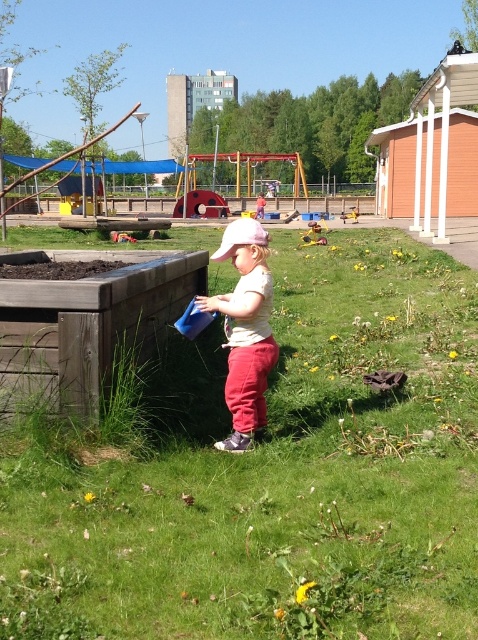
Does green grass at center have a smaller size compared to matte white shirt at center?

Incorrect, green grass at center is not smaller in size than matte white shirt at center.

This screenshot has height=640, width=478. What do you see at coordinates (271, 476) in the screenshot? I see `green grass at center` at bounding box center [271, 476].

Between point (53, 634) and point (234, 435), which one is positioned behind?

Point (234, 435)

Locate an element on the screen. Image resolution: width=478 pixels, height=640 pixels. green grass at center is located at coordinates (271, 476).